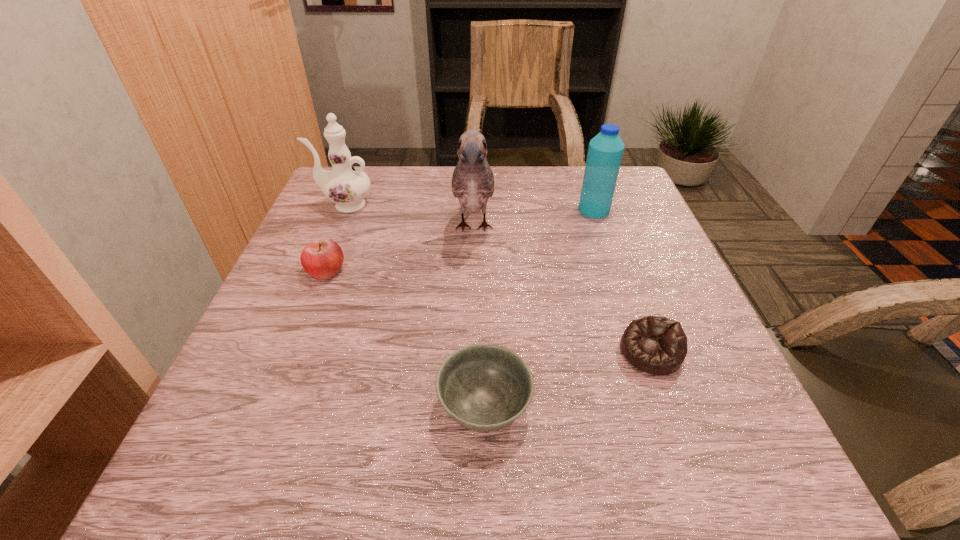
I want to click on parrot, so click(x=473, y=181).

Where is `chinaware`? The height and width of the screenshot is (540, 960). chinaware is located at coordinates (346, 186).

I want to click on water bottle, so click(x=605, y=151).

The image size is (960, 540). Identify the location of apple. (322, 259).

Find the location of `bowl`. bowl is located at coordinates (484, 387).

Find the location of a particular element. The width and height of the screenshot is (960, 540). beanbag is located at coordinates (656, 345).

Identify the location of vacant space located on the front-facing side of the parrot. The image size is (960, 540). (471, 357).

Find the location of a particular element. free region located on the front of the water bottle is located at coordinates (629, 309).

The width and height of the screenshot is (960, 540). What are the coordinates of `vacant space located on the back of the apple` in the screenshot? It's located at (358, 190).

The image size is (960, 540). Identify the location of vacant space located 0.300m on the back of the bowl. (483, 258).